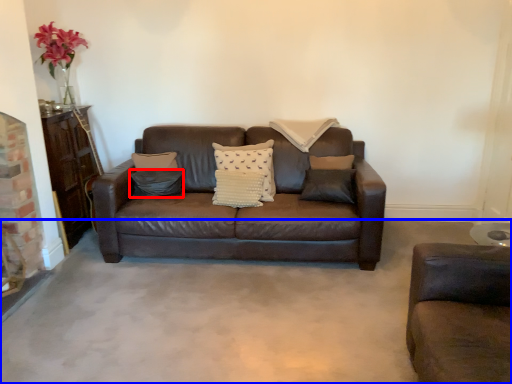
Question: Which of the following is the closest to the observer, pillow (highlighted by a red box) or concrete (highlighted by a blue box)?

Choices:
 (A) pillow
 (B) concrete

Answer: (B)